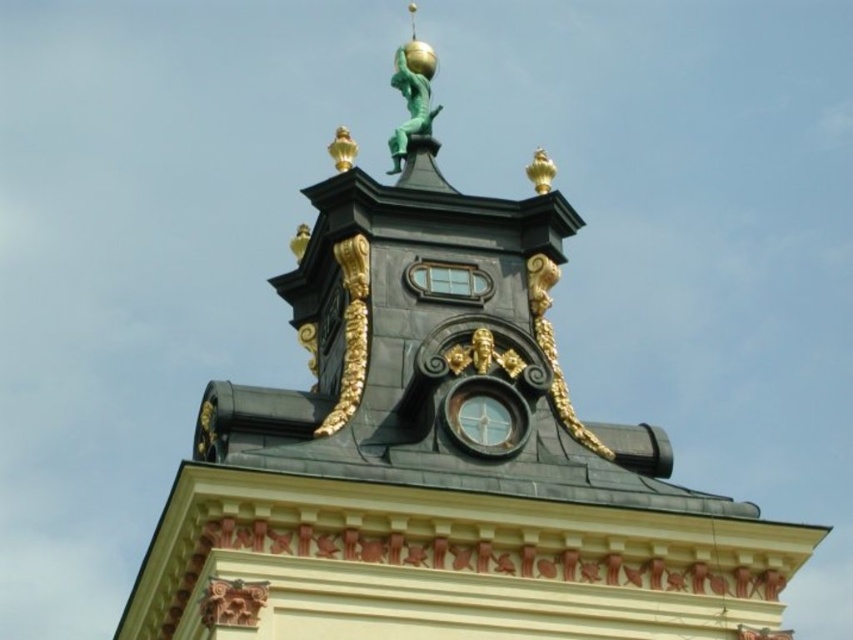
Question: Is matte black clock at center above gold metallic ornament at upper center?

Choices:
 (A) no
 (B) yes

Answer: (A)

Question: Estimate the real-world distances between objects in this image. Which object is closer to the gold metallic ornament at upper center?

Choices:
 (A) matte black clock at center
 (B) green patina figure at top

Answer: (A)

Question: Which object is closer to the camera taking this photo?

Choices:
 (A) green patina figure at top
 (B) matte black clock at center

Answer: (B)

Question: Is gold metallic ornament at upper center to the left of green patina figure at top from the viewer's perspective?

Choices:
 (A) no
 (B) yes

Answer: (B)

Question: Which point appears farthest from the camera in this image?

Choices:
 (A) pyautogui.click(x=352, y=387)
 (B) pyautogui.click(x=392, y=150)
 (C) pyautogui.click(x=463, y=387)

Answer: (B)

Question: Where is matte black clock at center located in relation to green patina figure at top in the image?

Choices:
 (A) above
 (B) below

Answer: (B)